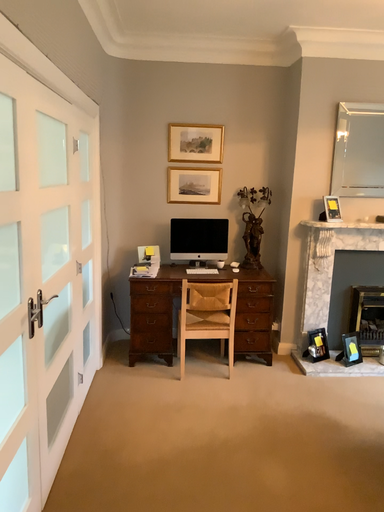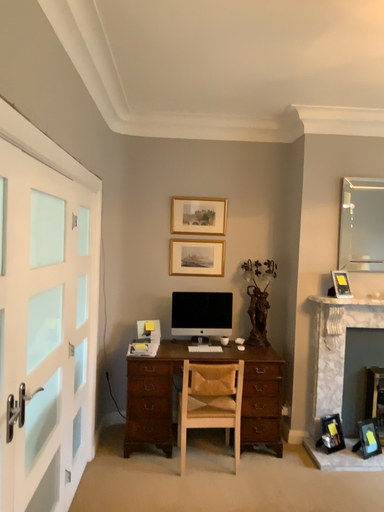
Question: Which way did the camera rotate in the video?

Choices:
 (A) rotated upward
 (B) rotated downward

Answer: (A)